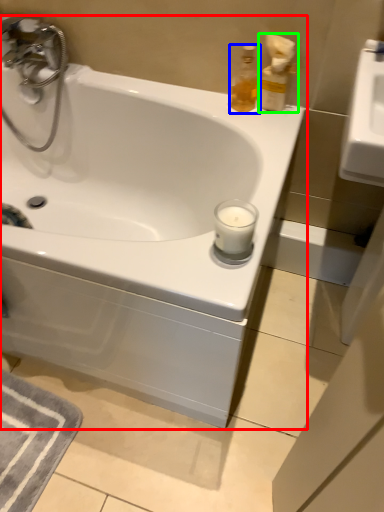
Question: Which object is the closest to the bathtub (highlighted by a red box)? Choose among these: soap dispenser (highlighted by a blue box) or soap dispenser (highlighted by a green box).

Choices:
 (A) soap dispenser
 (B) soap dispenser

Answer: (A)